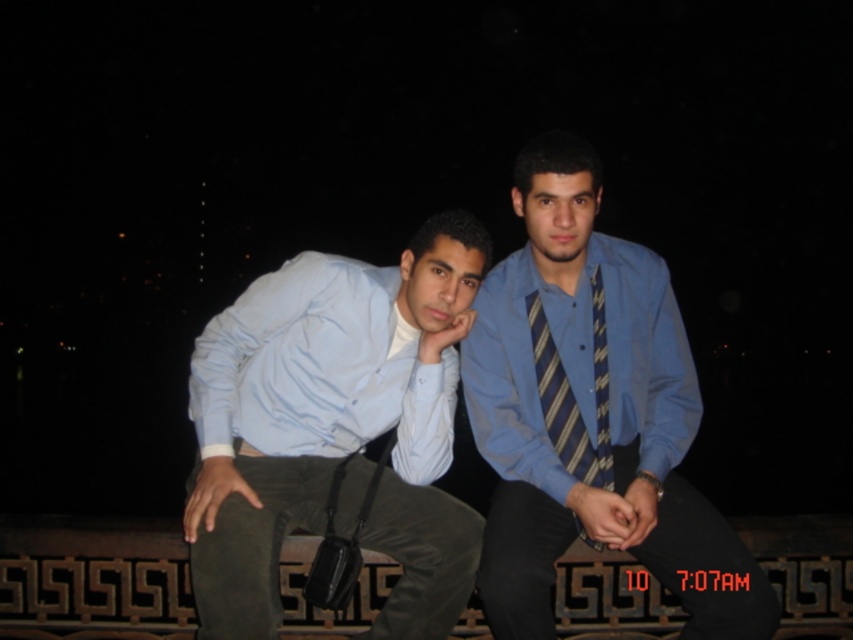
Which of these two, matte blue shirt at center or striped fabric tie at center, stands shorter?

striped fabric tie at center

At what (x,y) coordinates should I click in order to perform the action: click on matte blue shirt at center. Please return your answer as a coordinate pair (x, y). This screenshot has height=640, width=853. Looking at the image, I should click on tap(334, 428).

Locate an element on the screen. The height and width of the screenshot is (640, 853). matte blue shirt at center is located at coordinates (334, 428).

The image size is (853, 640). I want to click on matte blue shirt at center, so click(334, 428).

Can you confirm if blue striped tie at center is shorter than light blue cotton shirt at left?

No.

The image size is (853, 640). In order to click on blue striped tie at center in this screenshot , I will do `click(590, 413)`.

Between matte blue shirt at center and light blue cotton shirt at left, which one has less height?

Standing shorter between the two is light blue cotton shirt at left.

This screenshot has height=640, width=853. I want to click on matte blue shirt at center, so click(x=334, y=428).

You are a GUI agent. You are given a task and a screenshot of the screen. Output one action in this format:
    pyautogui.click(x=<x>, y=<y>)
    Task: Click on the matte blue shirt at center
    This screenshot has height=640, width=853.
    Given the screenshot: What is the action you would take?
    pyautogui.click(x=334, y=428)